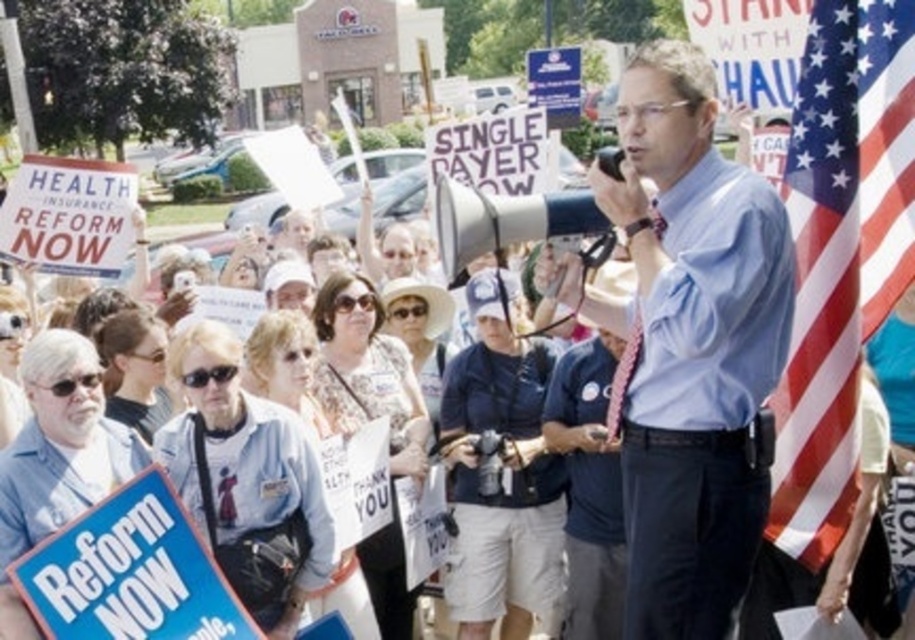
You are a photographer at the protest scene. You want to capture a photo where both the american flag at right and the blue cardboard placard at lower left are visible. Which object should you ensure is closer to the camera to include both in the frame?

The american flag at right is larger than the blue cardboard placard at lower left. To include both in the frame, you should position yourself closer to the blue cardboard placard at lower left so that its smaller size can be captured alongside the larger flag without either being cropped out.

You are a photographer trying to capture a clear shot of both the light blue shirt at center and the american flag at right. Based on their positions, which object should you focus on first to ensure both are in focus?

The light blue shirt at center is closer to the viewer than the american flag at right. To ensure both are in focus, you should focus on the light blue shirt at center first, as it is closer, and the flag will be in the background.